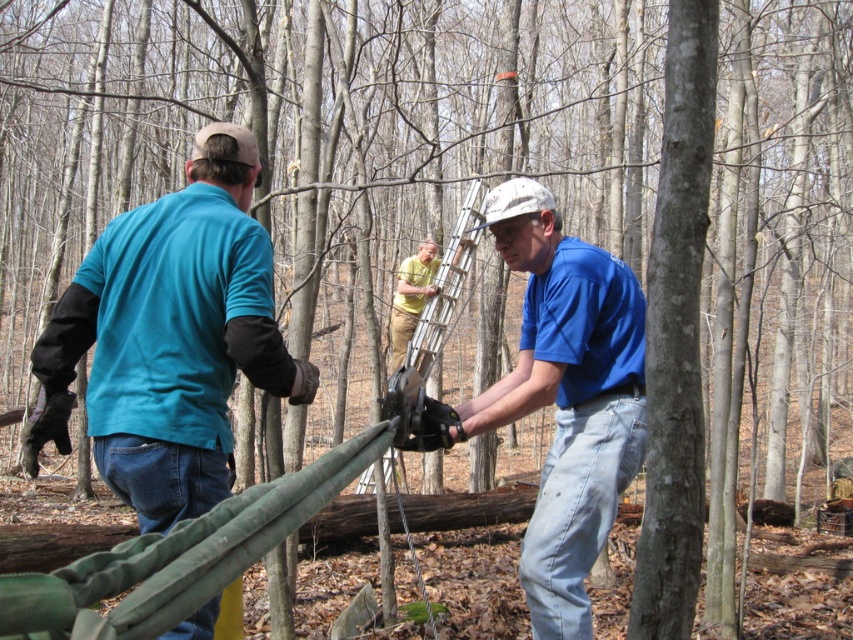
Can you confirm if teal fabric shirt at left is positioned to the right of yellow matte shirt at center?

No, teal fabric shirt at left is not to the right of yellow matte shirt at center.

Between teal fabric shirt at left and yellow matte shirt at center, which one is positioned lower?

teal fabric shirt at left is lower down.

Which is behind, point (134, 284) or point (426, 374)?

Point (426, 374)

At what (x,y) coordinates should I click in order to perform the action: click on teal fabric shirt at left. Please return your answer as a coordinate pair (x, y). The image size is (853, 640). Looking at the image, I should click on (170, 337).

Between teal fabric shirt at left and blue fabric at center, which one has more height?

Standing taller between the two is blue fabric at center.

Which is above, teal fabric shirt at left or blue fabric at center?

teal fabric shirt at left

Locate an element on the screen. This screenshot has height=640, width=853. teal fabric shirt at left is located at coordinates (170, 337).

Between blue fabric at center and yellow matte shirt at center, which one is positioned lower?

blue fabric at center is lower down.

From the picture: Between blue fabric at center and yellow matte shirt at center, which one appears on the right side from the viewer's perspective?

blue fabric at center is more to the right.

What do you see at coordinates (564, 408) in the screenshot? The height and width of the screenshot is (640, 853). I see `blue fabric at center` at bounding box center [564, 408].

Identify the location of blue fabric at center. (564, 408).